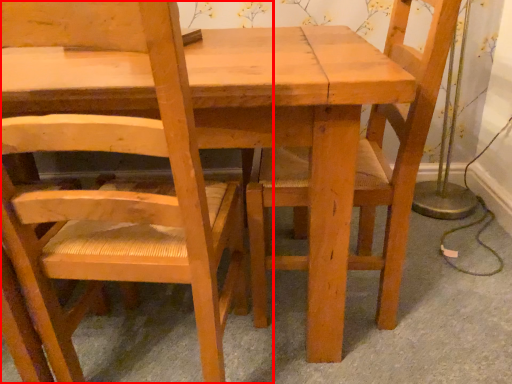
Question: Considering the relative positions of chair (annotated by the red box) and chair in the image provided, where is chair (annotated by the red box) located with respect to the staircase?

Choices:
 (A) right
 (B) left

Answer: (B)